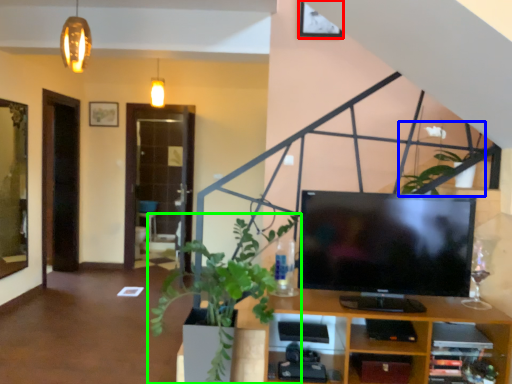
Question: Which object is positioned closest to picture frame (highlighted by a red box)? Select from plant (highlighted by a blue box) and houseplant (highlighted by a green box).

Choices:
 (A) plant
 (B) houseplant

Answer: (A)